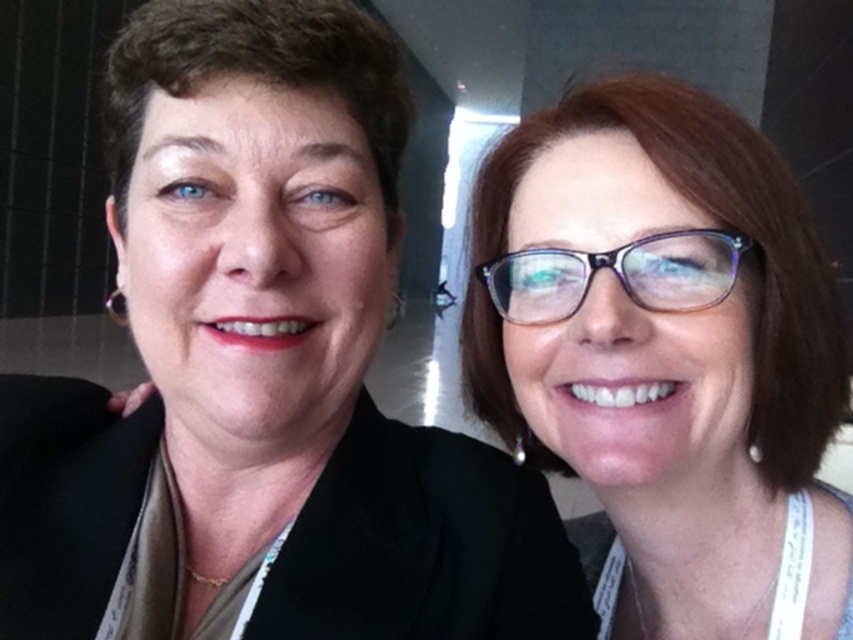
You are organizing a photo shoot and need to ensure that all matte black items are placed on a display stand. The stand can only accommodate items wider than 20 cm. Based on the scene, can both the matte black jacket at left and the matte black glasses at upper right be placed on the stand?

The matte black jacket at left has a larger width than the matte black glasses at upper right. However, since the stand requires items wider than 20 cm, we need to know the exact measurements. Unfortunately, the description only states that the jacket is wider than the glasses but doesn

You are a photographer at a conference and need to capture a closeup of the matte black glasses at upper right. Given that your camera can focus on objects within 20 inches, will you be able to take the photo without moving closer?

The matte black glasses at upper right are 19.60 inches away from the viewer, which is within the camera focus range of 20 inches. Therefore, you can take the photo without moving closer.

You are attending a conference and need to adjust your lanyard. You see the matte black jacket at left and the matte black glasses at upper right. Which object is closer to the top of the image?

The matte black glasses at upper right are closer to the top of the image because they are positioned above the matte black jacket at left.